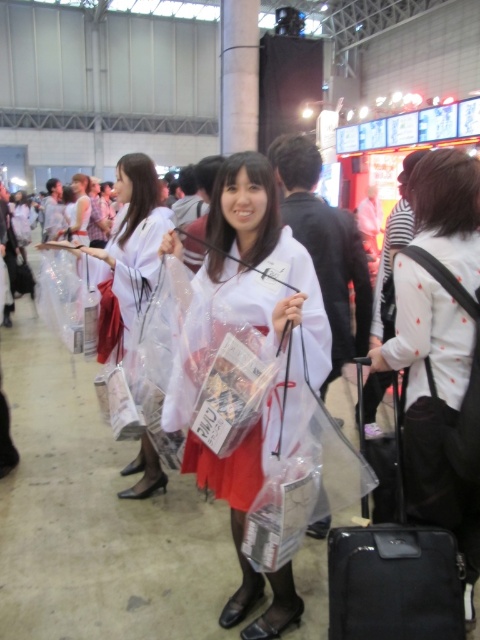
You are a photographer at the event and want to capture a clear shot of both the white dotted shirt at center and the white glossy kimono at center. Since the camera can only focus on one object at a time, which object should you focus on first to ensure the other is still in the frame?

You should focus on the white glossy kimono at center first because the white dotted shirt at center is below it, so adjusting focus to the shirt afterward will keep both in the frame.

You are standing in the middle of the event hall and see two points in the scene. The first point is at coordinate point (254, 481) and the second is at point (382, 483). Which point is closer to you?

Point (254, 481) is closer to the viewer than point (382, 483).